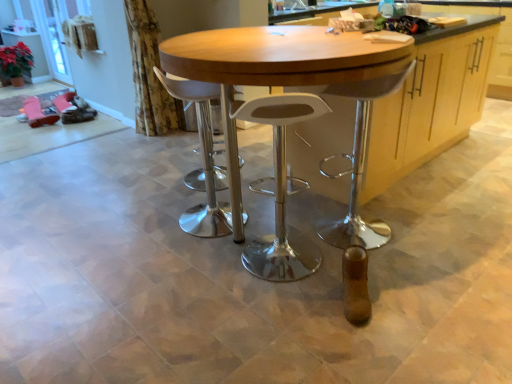
Locate an element on the screen. free space to the back side of white plastic stool at center, arranged as the second stool when viewed from the right is located at coordinates (219, 193).